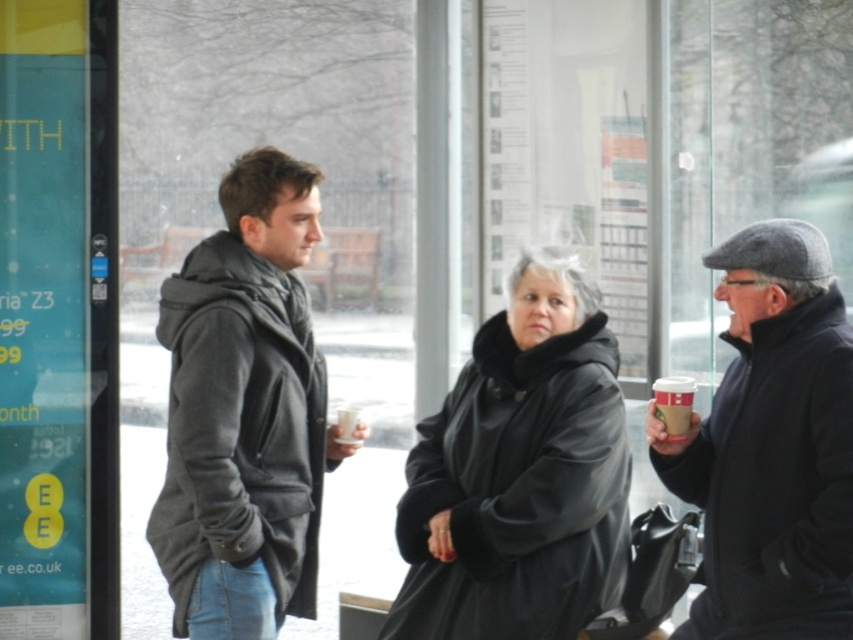
In the scene shown: You are at the bus stop and need to hand a note to the person wearing the black leather coat at center without touching the white paper cup at center. Which direction should you move the note towards?

The black leather coat at center is to the right of the white paper cup at center, so you should move the note towards the right direction.

You are a delivery person trying to place a small package on the ground between the black leather coat at center and the white paper cup at center. Can you fit the package there?

The black leather coat at center might be wider than the white paper cup at center, so there may not be enough space between them to place the small package.